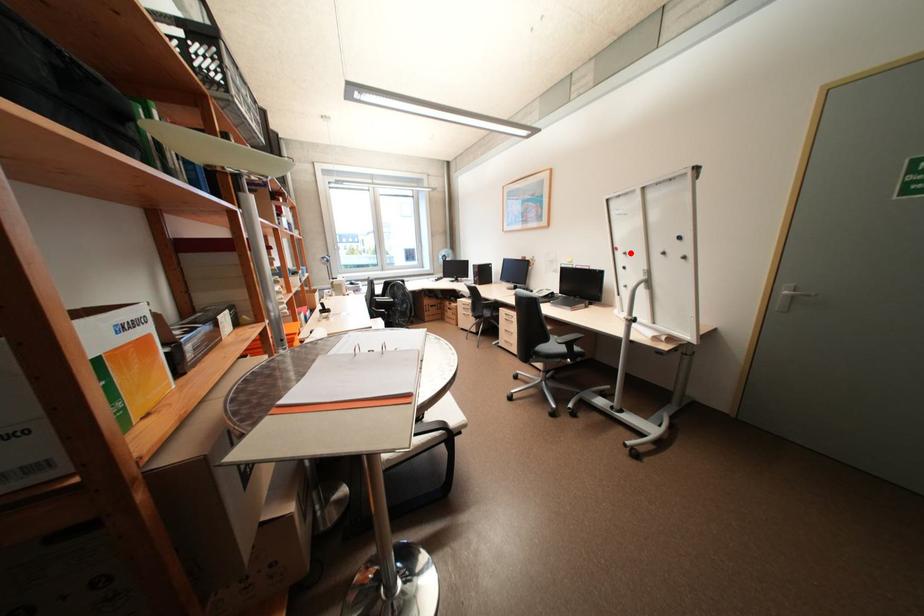
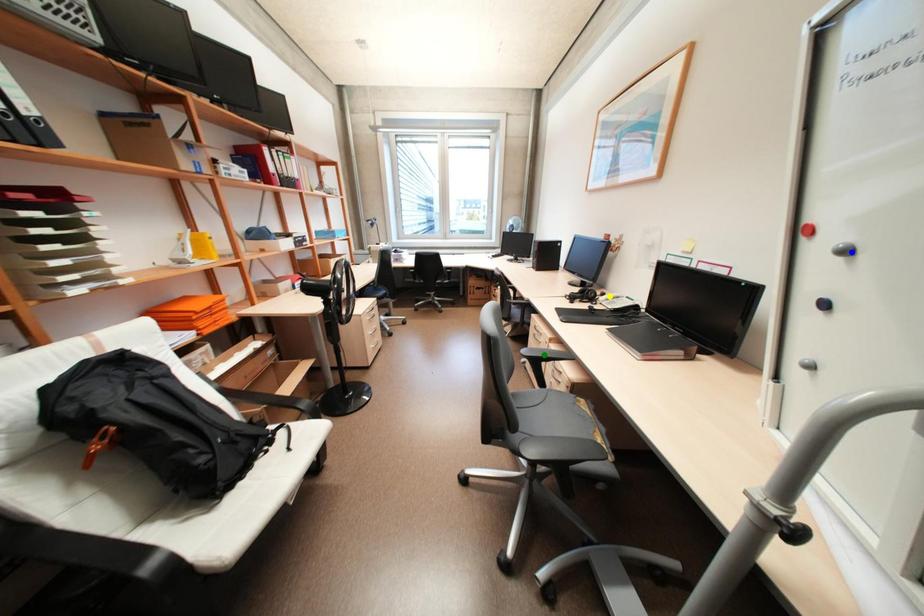
Question: I am providing you with two images of the same scene from different viewpoints. A red point is marked on the first image. You are given multiple points on the second image. Which point in image 2 is actually the same real-world point as the red point in image 1?

Choices:
 (A) yellow point
 (B) blue point
 (C) green point

Answer: (B)